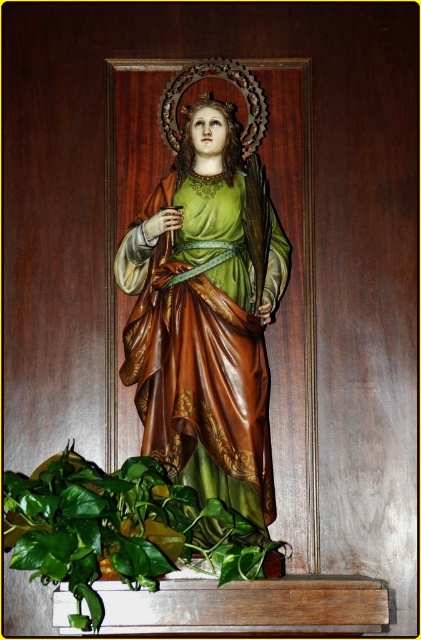
Consider the image. Between matte gold statue at center and green leafy plant at lower left, which one appears on the right side from the viewer's perspective?

Positioned to the right is matte gold statue at center.

Which of these two, matte gold statue at center or green leafy plant at lower left, stands shorter?

Standing shorter between the two is green leafy plant at lower left.

This screenshot has height=640, width=421. In order to click on matte gold statue at center in this screenshot , I will do `click(202, 321)`.